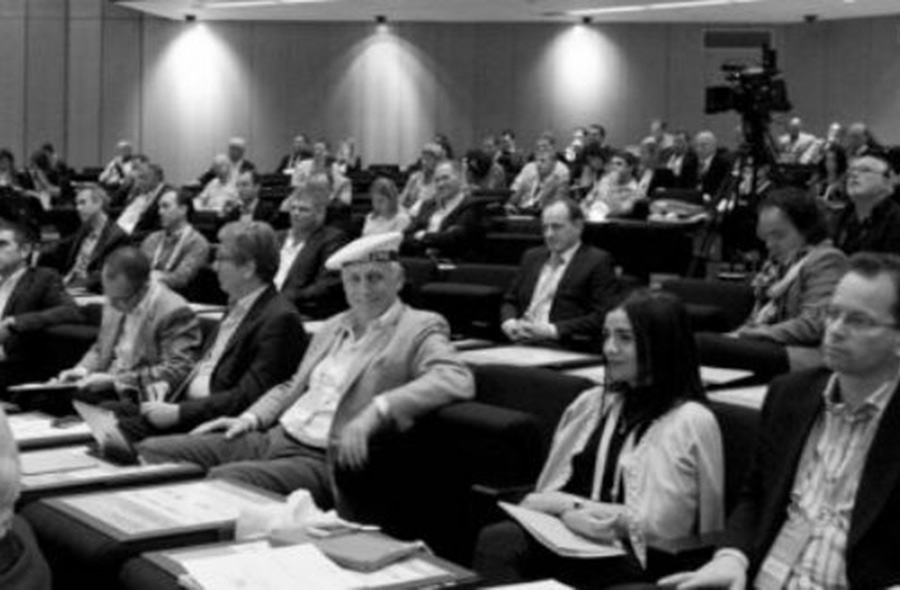
This screenshot has width=900, height=590. I want to click on 1 camera, so click(x=759, y=98).